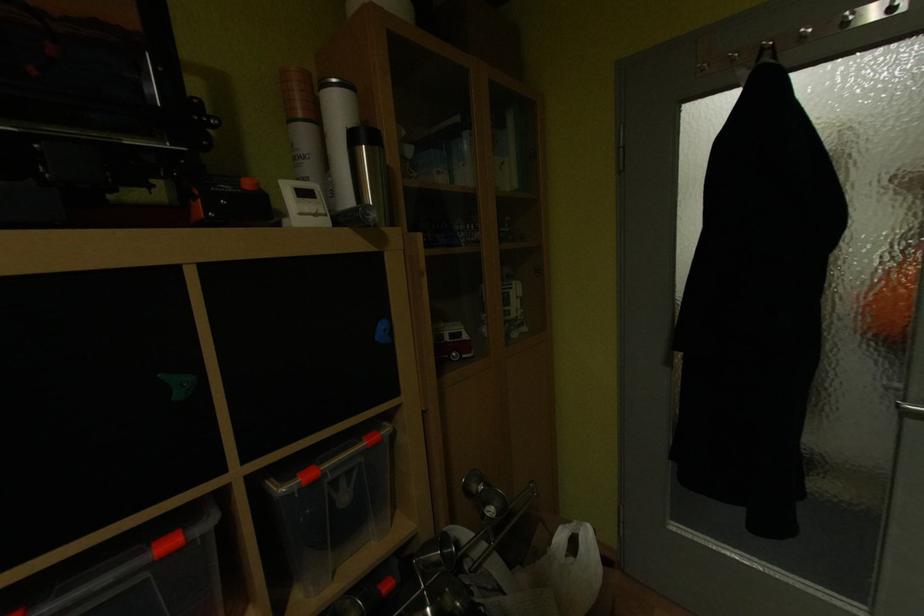
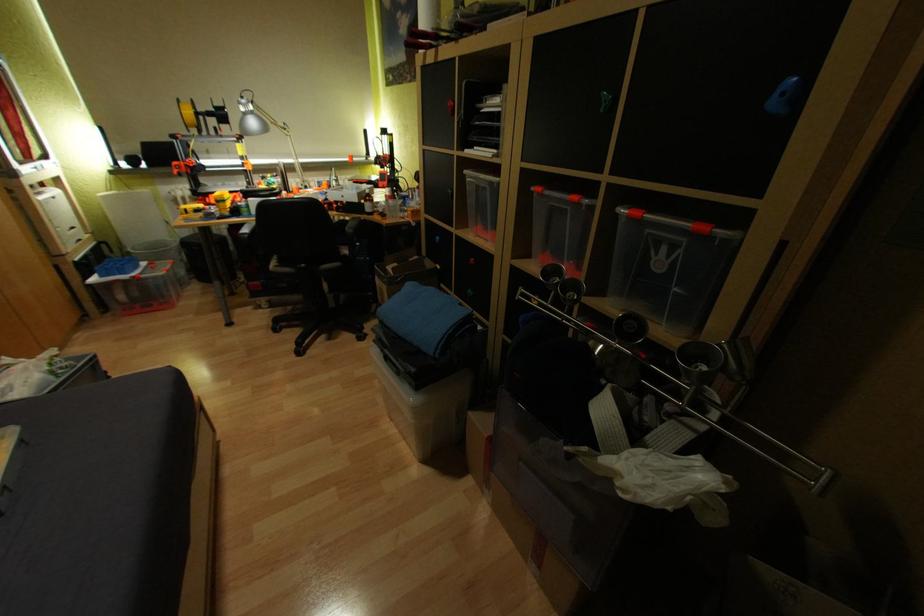
The first image is from the beginning of the video and the second image is from the end. How did the camera likely rotate when shooting the video?

The camera rotated toward left-down.